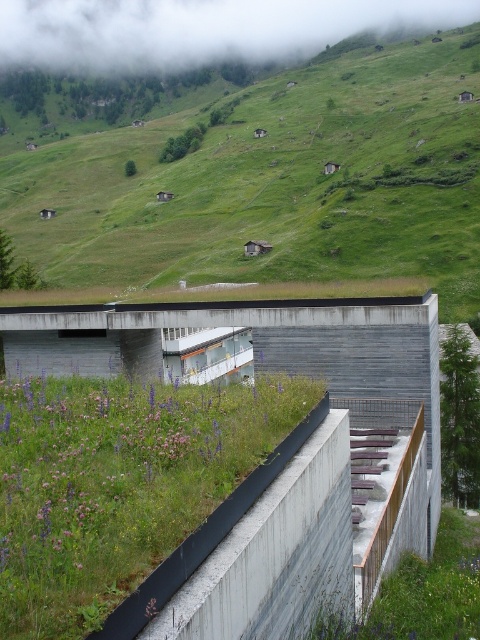
You are standing in the seating area under the green roof and looking towards the upper center of the image. Which object, the green grassy hillside at upper center or the white fluffy cloud at upper center, is closer to you?

The green grassy hillside at upper center is closer to you because it is positioned below the white fluffy cloud at upper center.

You are standing at the base of the structure in the image. Looking towards the upper center, can you see the green grassy hillside at upper center? Please explain your reasoning based on the coordinates provided.

Yes, the green grassy hillside at upper center is located at coordinates point (276, 182), which is within the upper center area of the image, so it should be visible from the base of the structure.

You are a landscape architect designing a new garden. You have two areas to consider in the image, the green grassy hillside at upper center and the green grass at center. Which area has a greater horizontal span?

The green grassy hillside at upper center has a larger width than the green grass at center, so it has a greater horizontal span.